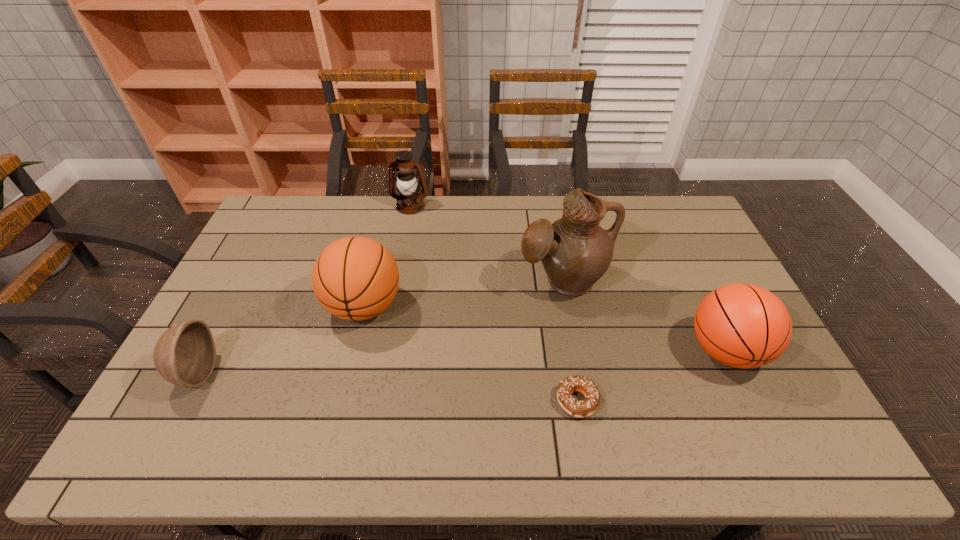
The image size is (960, 540). What are the coordinates of `the tallest object` in the screenshot? It's located at (575, 251).

Locate an element on the screen. This screenshot has width=960, height=540. lantern is located at coordinates (409, 202).

In order to click on the left basketball in this screenshot , I will do `click(354, 278)`.

At what (x,y) coordinates should I click in order to perform the action: click on the rightmost object. Please return your answer as a coordinate pair (x, y). This screenshot has height=540, width=960. Looking at the image, I should click on (741, 325).

Find the location of a particular element. Image resolution: width=960 pixels, height=540 pixels. the leftmost object is located at coordinates (185, 355).

The width and height of the screenshot is (960, 540). Find the location of `the fifth tallest object`. the fifth tallest object is located at coordinates (185, 355).

Find the location of a particular element. Image resolution: width=960 pixels, height=540 pixels. the shortest object is located at coordinates (583, 408).

The width and height of the screenshot is (960, 540). I want to click on vacant space located 0.290m at the spout of the tallest object, so click(x=585, y=392).

Where is `vacant space located on the side of the lantern, there is a wick adjustment knob`? vacant space located on the side of the lantern, there is a wick adjustment knob is located at coordinates (407, 226).

Where is `free spot located on the back of the left basketball`? The width and height of the screenshot is (960, 540). free spot located on the back of the left basketball is located at coordinates (386, 219).